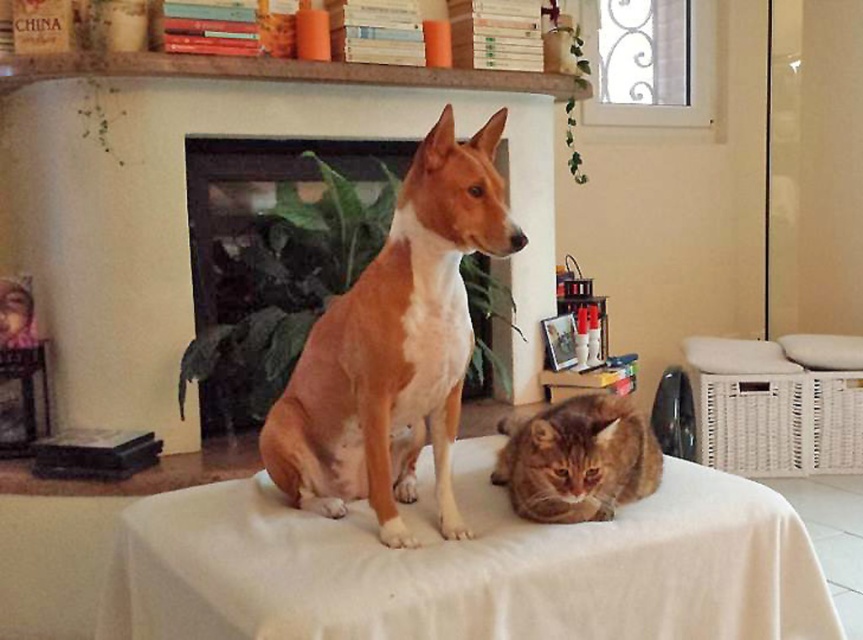
Between white cloth at center and brown smooth dog at center, which one appears on the right side from the viewer's perspective?

white cloth at center

Can you confirm if white cloth at center is wider than brown smooth dog at center?

Yes, white cloth at center is wider than brown smooth dog at center.

I want to click on white cloth at center, so click(468, 566).

Identify the location of white cloth at center. (468, 566).

Which is in front, point (344, 506) or point (614, 451)?

Positioned in front is point (614, 451).

What do you see at coordinates (395, 346) in the screenshot? The height and width of the screenshot is (640, 863). I see `brown smooth dog at center` at bounding box center [395, 346].

Identify the location of brown smooth dog at center. (395, 346).

What are the coordinates of `white cloth at center` in the screenshot? It's located at (468, 566).

Which is behind, point (203, 573) or point (577, 506)?

Positioned behind is point (577, 506).

Locate an element on the screen. The width and height of the screenshot is (863, 640). white cloth at center is located at coordinates (468, 566).